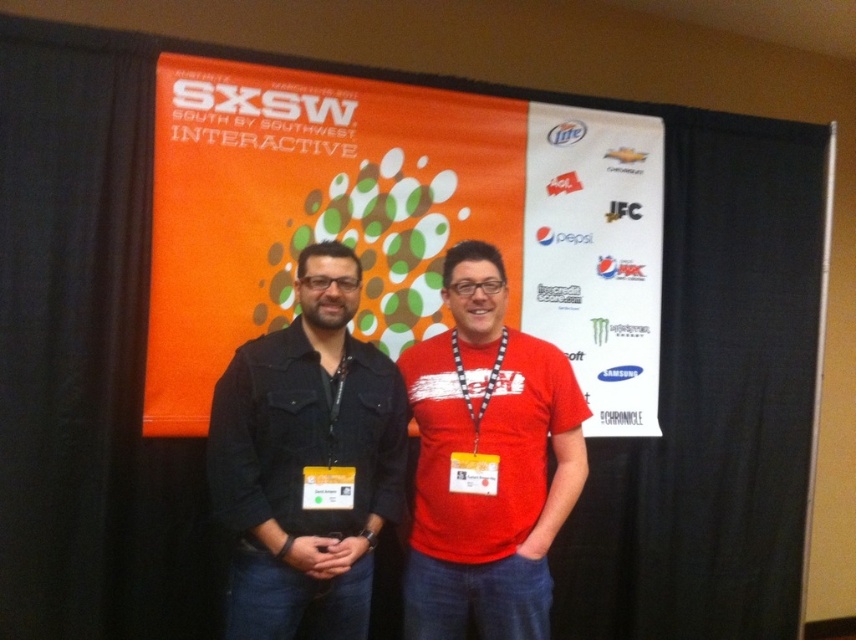
Question: Which object appears closest to the camera in this image?

Choices:
 (A) denim jacket at center
 (B) matte red t-shirt at center
 (C) orange fabric banner at upper center

Answer: (A)

Question: Does orange fabric banner at upper center have a lesser width compared to denim jacket at center?

Choices:
 (A) no
 (B) yes

Answer: (A)

Question: Is denim jacket at center positioned in front of matte red t-shirt at center?

Choices:
 (A) yes
 (B) no

Answer: (A)

Question: Which of these objects is positioned farthest from the orange fabric banner at upper center?

Choices:
 (A) denim jacket at center
 (B) matte red t-shirt at center

Answer: (B)

Question: Is denim jacket at center closer to camera compared to matte red t-shirt at center?

Choices:
 (A) yes
 (B) no

Answer: (A)

Question: Based on their relative distances, which object is farther from the denim jacket at center?

Choices:
 (A) matte red t-shirt at center
 (B) orange fabric banner at upper center

Answer: (B)